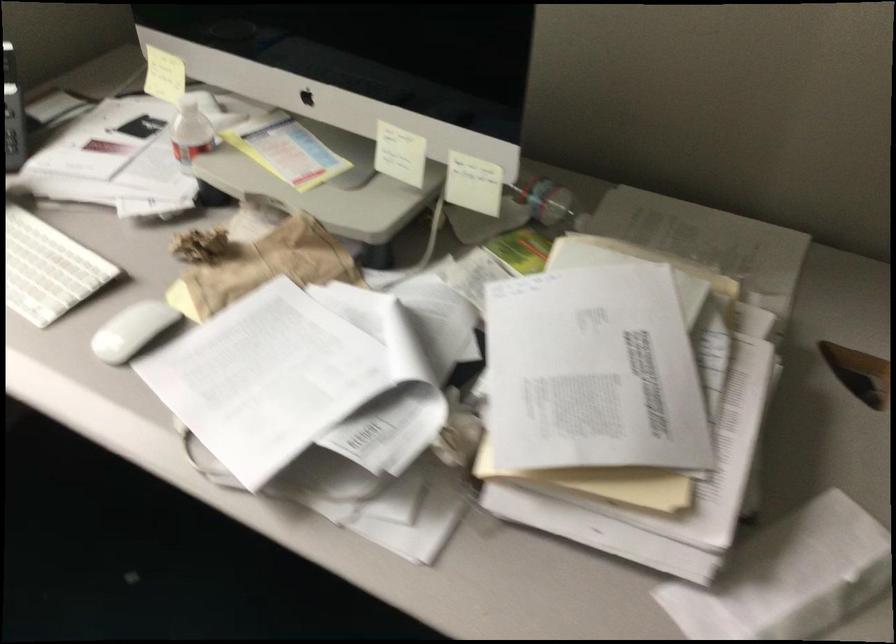
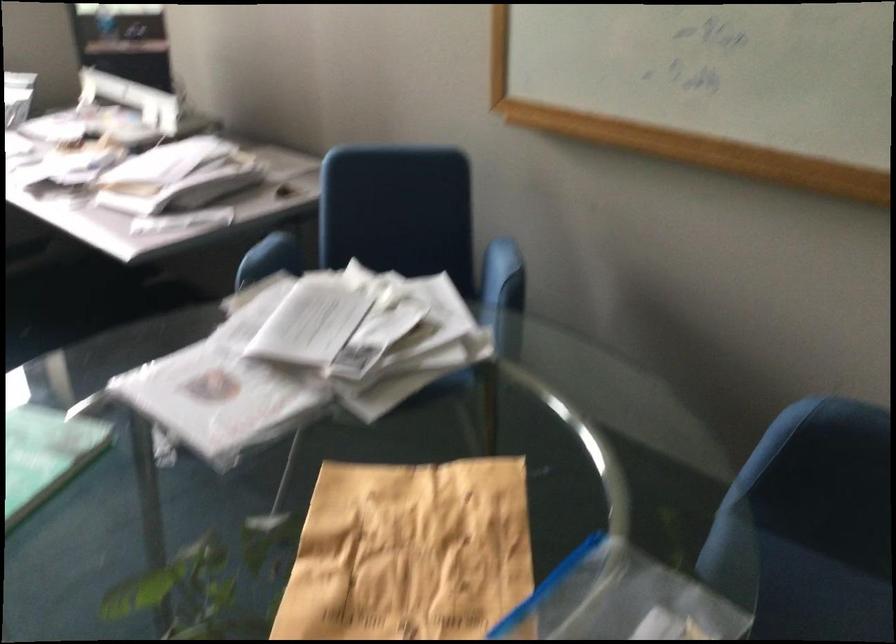
From the picture: In a continuous first-person perspective shot, in which direction is the camera moving?

The movement direction of the cameraman is right, backward.